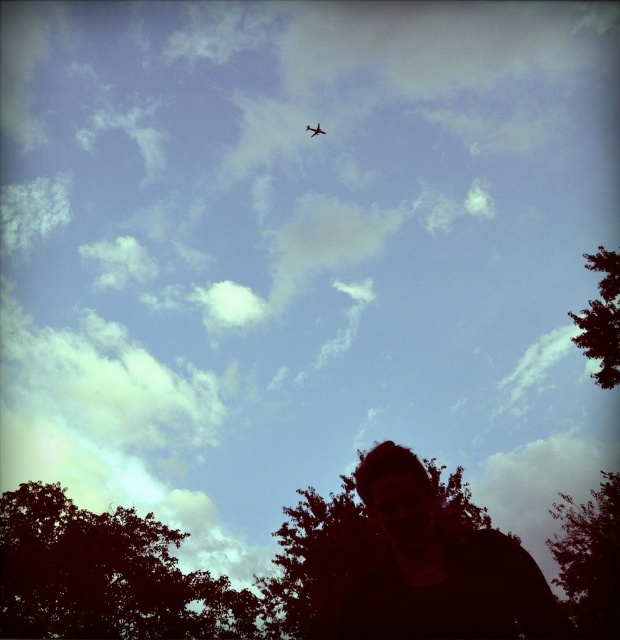
Question: Which object is the closest to the dark green leafy tree at lower left?

Choices:
 (A) metallic airplane at upper center
 (B) green leafy tree at upper right
 (C) dark green leafy tree at lower right

Answer: (C)

Question: Which object is closer to the camera taking this photo?

Choices:
 (A) metallic airplane at upper center
 (B) green leafy tree at upper right
 (C) dark green leafy tree at lower left

Answer: (B)

Question: Does green leafy tree at upper right appear over metallic airplane at upper center?

Choices:
 (A) yes
 (B) no

Answer: (B)

Question: Which point is closer to the camera taking this photo?

Choices:
 (A) (559, 548)
 (B) (69, 522)
 (C) (618, 316)
 (D) (314, 131)

Answer: (C)

Question: Is dark green leafy tree at lower right further to camera compared to metallic airplane at upper center?

Choices:
 (A) yes
 (B) no

Answer: (B)

Question: Does dark green leafy tree at lower right come in front of metallic airplane at upper center?

Choices:
 (A) no
 (B) yes

Answer: (B)